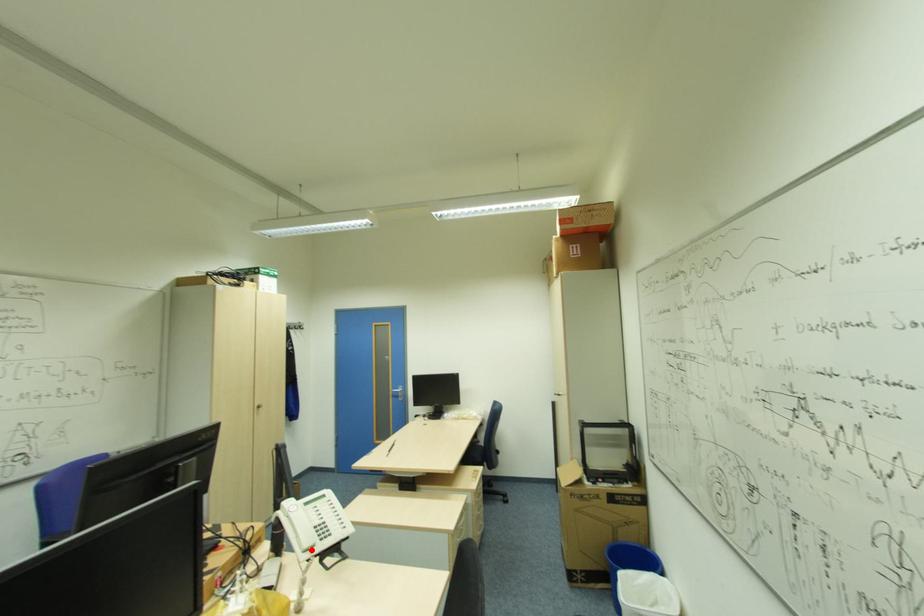
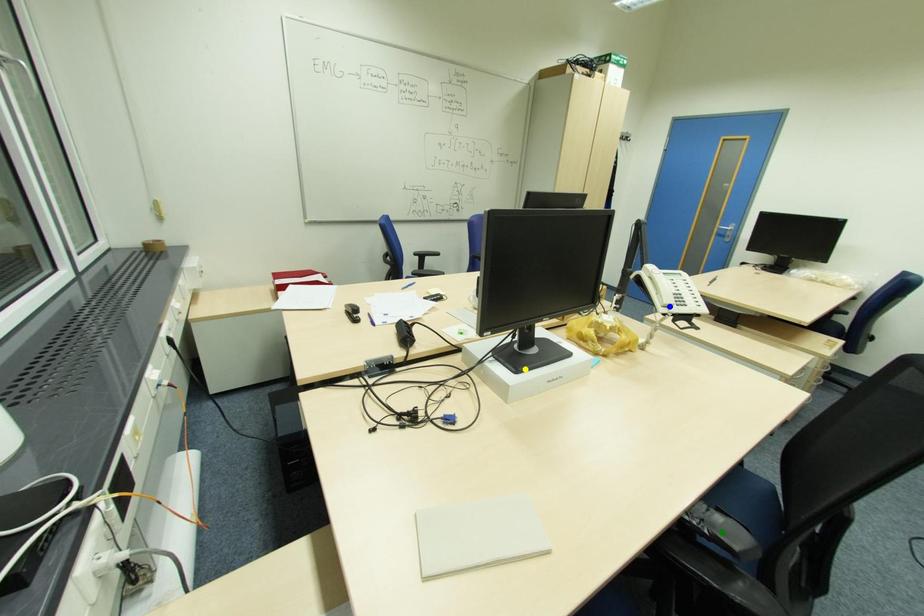
Question: I am providing you with two images of the same scene from different viewpoints. A red point is marked on the first image. You are given multiple points on the second image. Which spot in image 2 lines up with the point in image 1?

Choices:
 (A) green point
 (B) blue point
 (C) yellow point

Answer: (B)